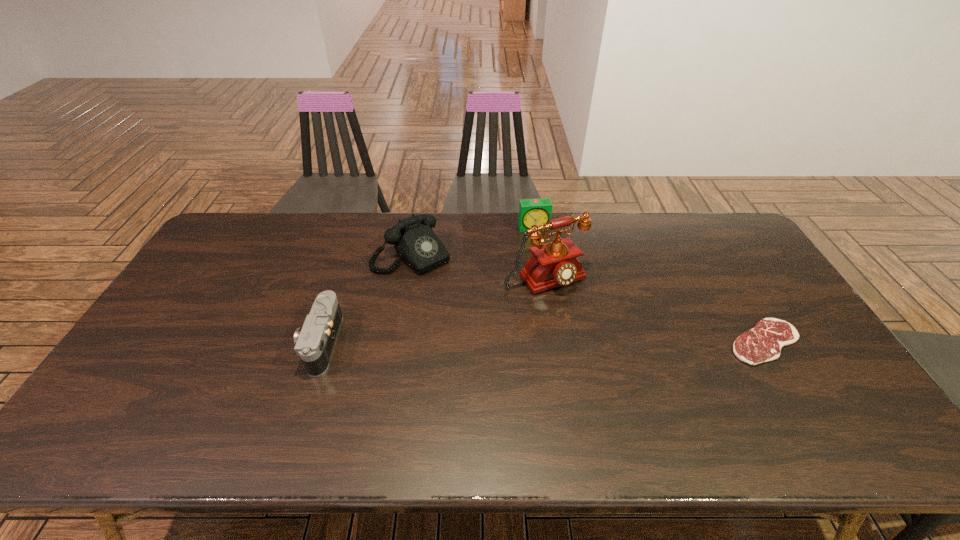
Locate an element on the screen. blank space that satisfies the following two spatial constraints: 1. on the front side of the right telephone; 2. on the left side of the alarm clock is located at coordinates (541, 279).